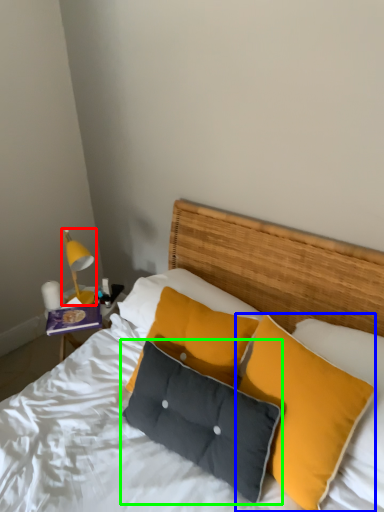
Question: Considering the real-world distances, which object is closest to bedside lamp (highlighted by a red box)? pillow (highlighted by a blue box) or pillow (highlighted by a green box).

Choices:
 (A) pillow
 (B) pillow

Answer: (B)